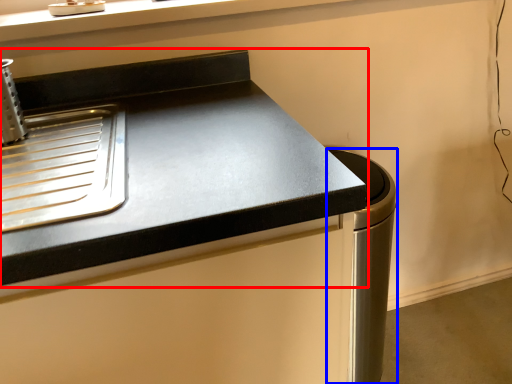
Question: Which of the following is the farthest to the observer, countertop (highlighted by a red box) or appliance (highlighted by a blue box)?

Choices:
 (A) countertop
 (B) appliance

Answer: (B)